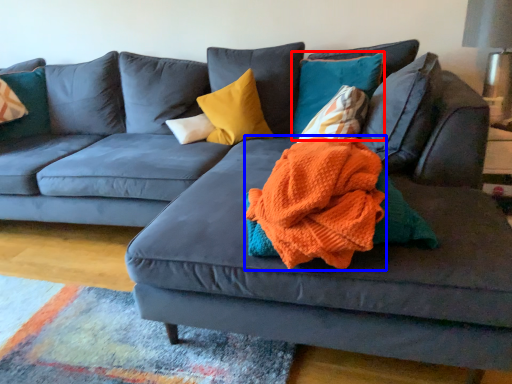
Question: Among these objects, which one is nearest to the camera, pillow (highlighted by a red box) or blanket (highlighted by a blue box)?

Choices:
 (A) pillow
 (B) blanket

Answer: (B)